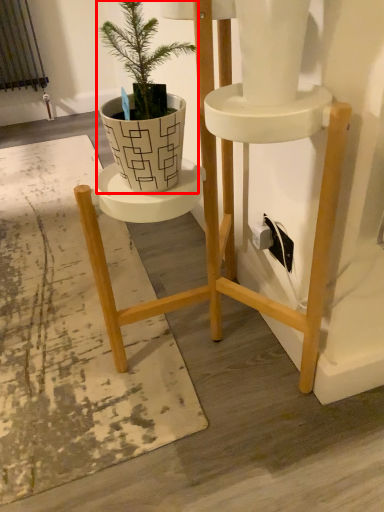
Question: From the image's perspective, what is the correct spatial relationship of houseplant (annotated by the red box) in relation to mat?

Choices:
 (A) below
 (B) above

Answer: (B)